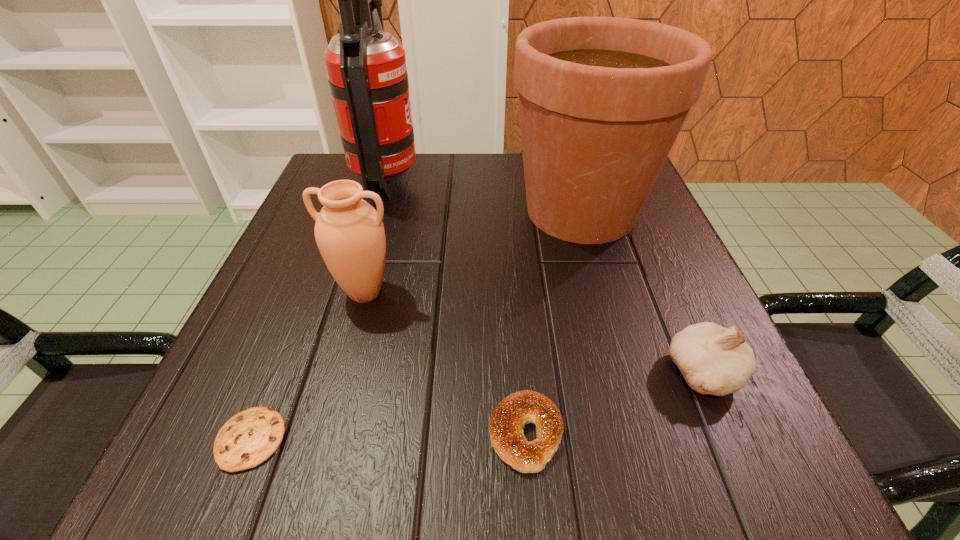
Find the location of a particular element. Image resolution: width=960 pixels, height=540 pixels. the tallest object is located at coordinates (366, 67).

Locate an element on the screen. This screenshot has width=960, height=540. flowerpot is located at coordinates (602, 100).

Where is `the fourth shortest object`? the fourth shortest object is located at coordinates (349, 232).

The image size is (960, 540). Find the location of `the fourth nearest object`. the fourth nearest object is located at coordinates (349, 232).

You are a GUI agent. You are given a task and a screenshot of the screen. Output one action in this format:
    pyautogui.click(x=<x>, y=<y>)
    Task: Click on the fourth tallest object
    The image size is (960, 540).
    Given the screenshot: What is the action you would take?
    pyautogui.click(x=715, y=360)

This screenshot has width=960, height=540. Identify the location of the fifth tallest object. (506, 425).

I want to click on the shortest object, so click(x=250, y=437).

At what (x,y) coordinates should I click in order to perform the action: click on free location located on the front label side of the tallest object. Please return your answer as a coordinate pair (x, y). Looking at the image, I should click on (475, 179).

Where is `free point located on the front of the flowerpot`? The width and height of the screenshot is (960, 540). free point located on the front of the flowerpot is located at coordinates (606, 296).

The height and width of the screenshot is (540, 960). I want to click on vacant space situated 0.080m on the right of the fourth nearest object, so click(446, 293).